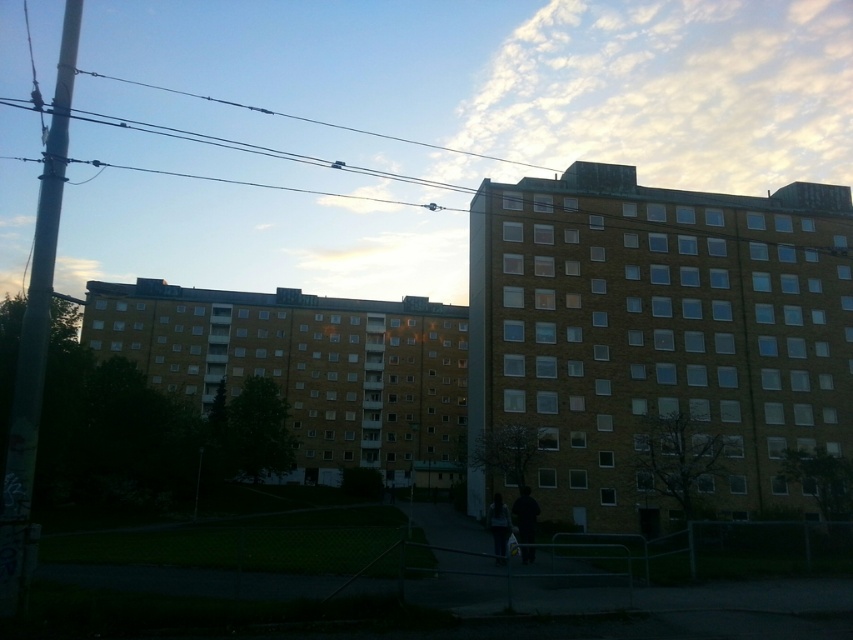
Question: Does dark gray fabric jacket at lower center appear on the left side of dark blue jeans at lower center?

Choices:
 (A) no
 (B) yes

Answer: (A)

Question: Which point is closer to the camera?

Choices:
 (A) (523, 522)
 (B) (496, 561)

Answer: (B)

Question: Which point appears farthest from the camera in this image?

Choices:
 (A) (521, 552)
 (B) (496, 548)

Answer: (A)

Question: Does dark gray fabric jacket at lower center lie behind dark blue jeans at lower center?

Choices:
 (A) yes
 (B) no

Answer: (B)

Question: Considering the relative positions of dark gray fabric jacket at lower center and dark blue jeans at lower center in the image provided, where is dark gray fabric jacket at lower center located with respect to dark blue jeans at lower center?

Choices:
 (A) right
 (B) left

Answer: (A)